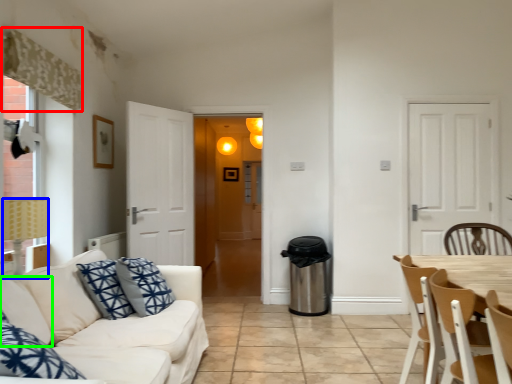
Question: Based on their relative distances, which object is nearer to curtain (highlighted by a red box)? Choose from lamp (highlighted by a blue box) and pillow (highlighted by a green box).

Choices:
 (A) lamp
 (B) pillow

Answer: (A)